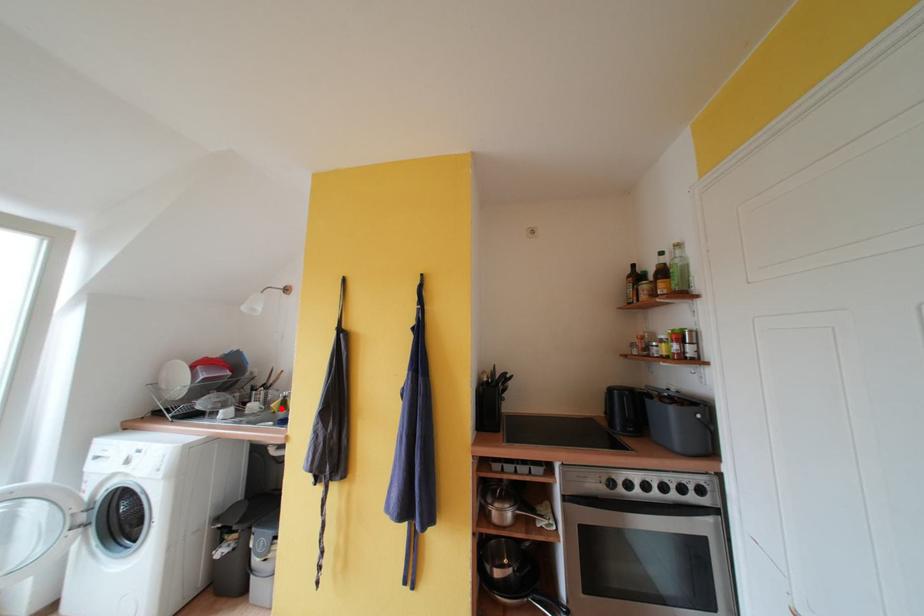
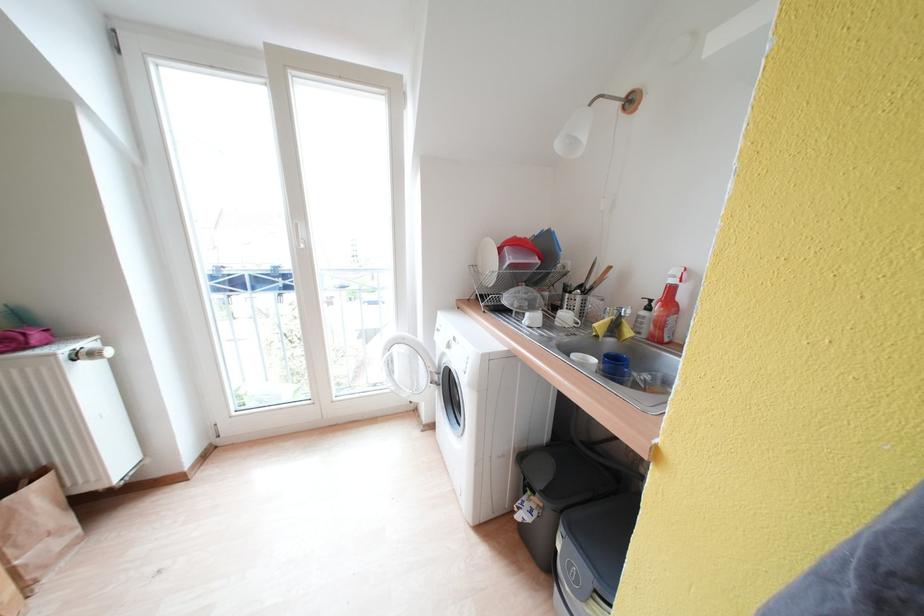
Question: I am providing you with two images of the same scene from different viewpoints. A red point is shown in image1. For the corresponding object point in image2, is it positioned nearer or farther from the camera?

Choices:
 (A) Nearer
 (B) Farther

Answer: (A)